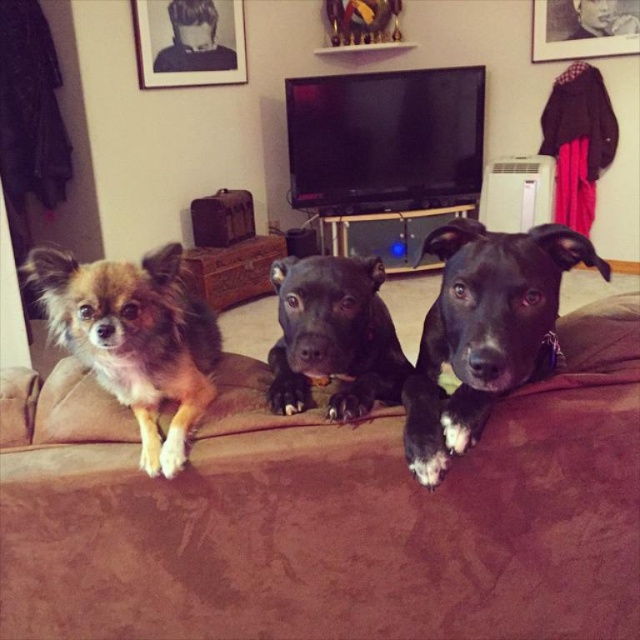
Question: Considering the relative positions of black matte dog at center and fuzzy brown dog at left in the image provided, where is black matte dog at center located with respect to fuzzy brown dog at left?

Choices:
 (A) above
 (B) below

Answer: (A)

Question: Which object is closer to the camera taking this photo?

Choices:
 (A) fuzzy brown dog at left
 (B) black matte dog at center
 (C) brown fabric couch at center

Answer: (B)

Question: Can you confirm if black matte dog at center is positioned to the right of fuzzy brown dog at left?

Choices:
 (A) no
 (B) yes

Answer: (B)

Question: Among these objects, which one is farthest from the camera?

Choices:
 (A) black matte dog at center
 (B) brown fabric couch at center
 (C) fuzzy brown dog at left

Answer: (C)

Question: Is brown fabric couch at center bigger than black matte dog at center?

Choices:
 (A) no
 (B) yes

Answer: (B)

Question: Which of the following is the closest to the observer?

Choices:
 (A) fuzzy brown dog at left
 (B) black matte dog at center
 (C) brown fabric couch at center

Answer: (B)